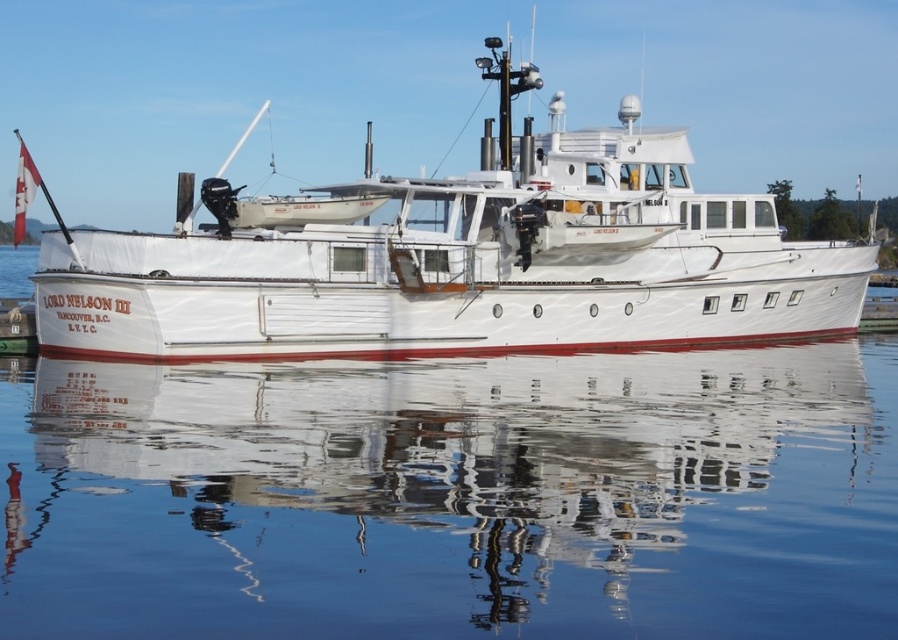
You are standing on the dock and looking at the transparent water at center and the white wooden boat at center. Which object is located lower in the image?

The transparent water at center is located lower than the white wooden boat at center in the image.

You are standing on the deck of the Lord Nelson III motor yacht. You see two points marked on the deck. The first point is at coordinates point (553, 627), and the second point is at point (196, 237). If you want to move from the first point to the second point, which direction should you face to walk directly towards the second point?

To move from point (553, 627) to point (196, 237), you should face a direction towards the lower left, as point (196, 237) is located behind point (553, 627) based on their coordinates.

You are a marine biologist planning to measure the water quality at the transparent water at center near the white wooden boat at center. Given that your equipment has a maximum reach of 40 feet, will you be able to collect samples without moving the boat?

The distance between the transparent water at center and the white wooden boat at center is 44.10 feet, which exceeds the equipment reach of 40 feet. Therefore, you will need to move the boat closer to collect samples.